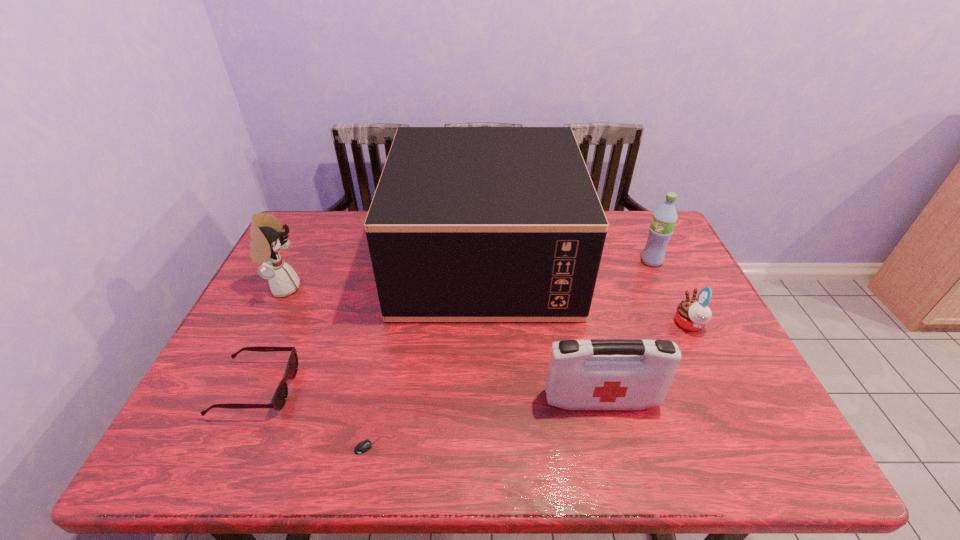
Locate an element on the screen. vacant space located on the front-facing side of the box is located at coordinates click(307, 259).

Find the location of a particular element. free space located at the front face of the doll is located at coordinates (319, 288).

Locate an element on the screen. This screenshot has width=960, height=540. blank space located 0.240m on the front of the water bottle is located at coordinates (682, 326).

Image resolution: width=960 pixels, height=540 pixels. Find the location of `free point located 0.120m on the front side of the fourth shortest object`. free point located 0.120m on the front side of the fourth shortest object is located at coordinates (617, 465).

The image size is (960, 540). Find the location of `free location located on the front-facing side of the muffin`. free location located on the front-facing side of the muffin is located at coordinates (584, 324).

Where is `vacant region located on the front-facing side of the muffin`? The image size is (960, 540). vacant region located on the front-facing side of the muffin is located at coordinates (613, 324).

Image resolution: width=960 pixels, height=540 pixels. What are the coordinates of `vacant space located 0.260m on the front-facing side of the muffin` in the screenshot? It's located at (576, 324).

Locate an element on the screen. This screenshot has height=540, width=960. free region located 0.130m at the front lenses of the second shortest object is located at coordinates pos(348,388).

What are the coordinates of `free space located on the back of the nearest object` in the screenshot? It's located at (383, 399).

The width and height of the screenshot is (960, 540). I want to click on object at the far edge, so click(467, 224).